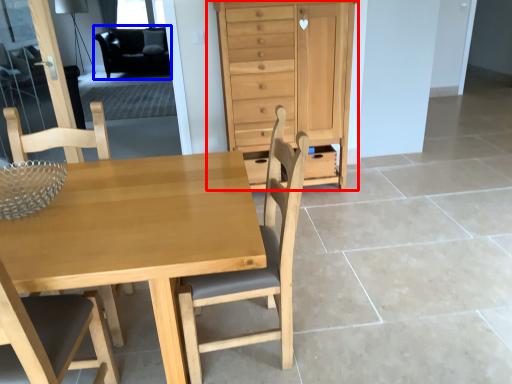
Question: Among these objects, which one is farthest to the camera, chest of drawers (highlighted by a red box) or armchair (highlighted by a blue box)?

Choices:
 (A) chest of drawers
 (B) armchair

Answer: (B)